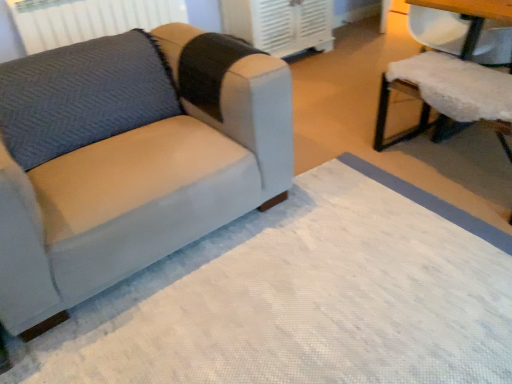
Question: Is suede-like gray couch at left a part of white fluffy cushion at right?

Choices:
 (A) yes
 (B) no

Answer: (B)

Question: From a real-world perspective, is white fluffy cushion at right under suede-like gray couch at left?

Choices:
 (A) no
 (B) yes

Answer: (A)

Question: Considering the relative positions of white fluffy cushion at right and suede-like gray couch at left in the image provided, is white fluffy cushion at right to the left of suede-like gray couch at left from the viewer's perspective?

Choices:
 (A) no
 (B) yes

Answer: (A)

Question: From the image's perspective, does white fluffy cushion at right appear lower than suede-like gray couch at left?

Choices:
 (A) yes
 (B) no

Answer: (B)

Question: Does white fluffy cushion at right turn towards suede-like gray couch at left?

Choices:
 (A) no
 (B) yes

Answer: (B)

Question: From a real-world perspective, is gray fabric radiator at upper left positioned above or below suede-like gray couch at left?

Choices:
 (A) above
 (B) below

Answer: (A)

Question: In the image, is gray fabric radiator at upper left positioned in front of or behind suede-like gray couch at left?

Choices:
 (A) front
 (B) behind

Answer: (B)

Question: In terms of width, does gray fabric radiator at upper left look wider or thinner when compared to suede-like gray couch at left?

Choices:
 (A) wide
 (B) thin

Answer: (B)

Question: Based on their sizes in the image, would you say gray fabric radiator at upper left is bigger or smaller than suede-like gray couch at left?

Choices:
 (A) small
 (B) big

Answer: (A)

Question: Is suede-like gray couch at left inside the boundaries of gray fabric radiator at upper left, or outside?

Choices:
 (A) inside
 (B) outside

Answer: (B)

Question: Based on their positions, is suede-like gray couch at left located to the left or right of gray fabric radiator at upper left?

Choices:
 (A) left
 (B) right

Answer: (B)

Question: Considering the positions of point (86, 230) and point (54, 41), is point (86, 230) closer or farther from the camera than point (54, 41)?

Choices:
 (A) closer
 (B) farther

Answer: (A)

Question: In terms of width, does suede-like gray couch at left look wider or thinner when compared to gray fabric radiator at upper left?

Choices:
 (A) wide
 (B) thin

Answer: (A)

Question: Choose the correct answer: Is white textured mat at lower left inside gray fabric radiator at upper left or outside it?

Choices:
 (A) inside
 (B) outside

Answer: (B)

Question: Is white textured mat at lower left wider or thinner than gray fabric radiator at upper left?

Choices:
 (A) wide
 (B) thin

Answer: (A)